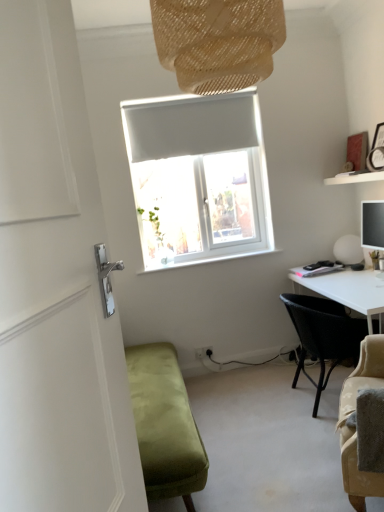
This screenshot has width=384, height=512. Identify the location of vacant space underneath black woven chair at right (from a real-world perspective). (311, 397).